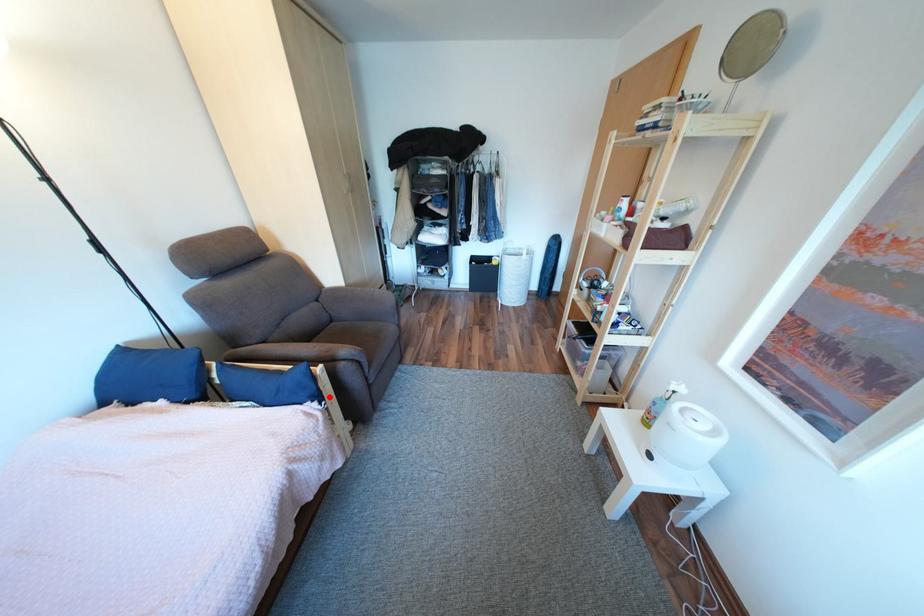
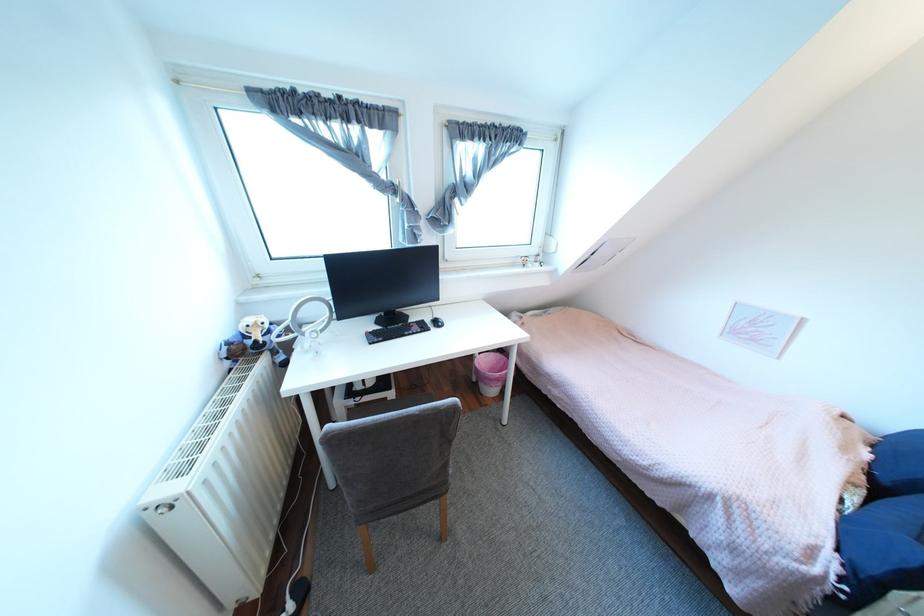
The point at the highlighted location is marked in the first image. Where is the corresponding point in the second image?

(873, 586)